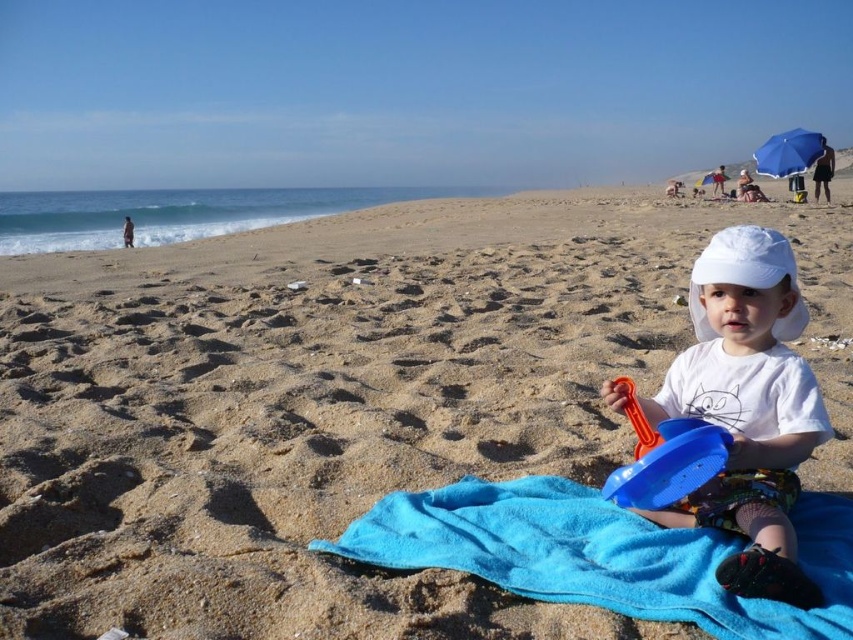
Question: Is blue fabric towel at center closer to the viewer compared to white cotton shirt at lower right?

Choices:
 (A) yes
 (B) no

Answer: (A)

Question: Considering the relative positions of white cotton shirt at lower right and blue plastic bucket at lower right in the image provided, where is white cotton shirt at lower right located with respect to blue plastic bucket at lower right?

Choices:
 (A) left
 (B) right

Answer: (B)

Question: Is blue soft towel at lower center smaller than white cotton shirt at lower right?

Choices:
 (A) no
 (B) yes

Answer: (B)

Question: Which object is positioned farthest from the blue plastic bucket at lower right?

Choices:
 (A) white cotton shirt at lower right
 (B) blue soft towel at lower center
 (C) blue fabric towel at center

Answer: (C)

Question: Which point is closer to the camera?

Choices:
 (A) (781, 260)
 (B) (686, 460)

Answer: (B)

Question: Which object is the farthest from the white cotton shirt at lower right?

Choices:
 (A) blue soft towel at lower center
 (B) blue plastic bucket at lower right
 (C) white matte baseball hat at center
 (D) blue fabric towel at center

Answer: (D)